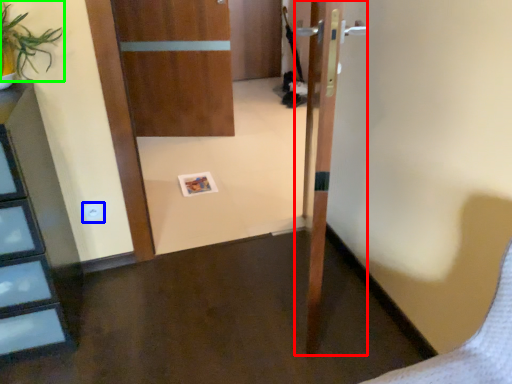
Question: Estimate the real-world distances between objects in this image. Which object is closer to door (highlighted by a red box), electric outlet (highlighted by a blue box) or plant (highlighted by a green box)?

Choices:
 (A) electric outlet
 (B) plant

Answer: (B)